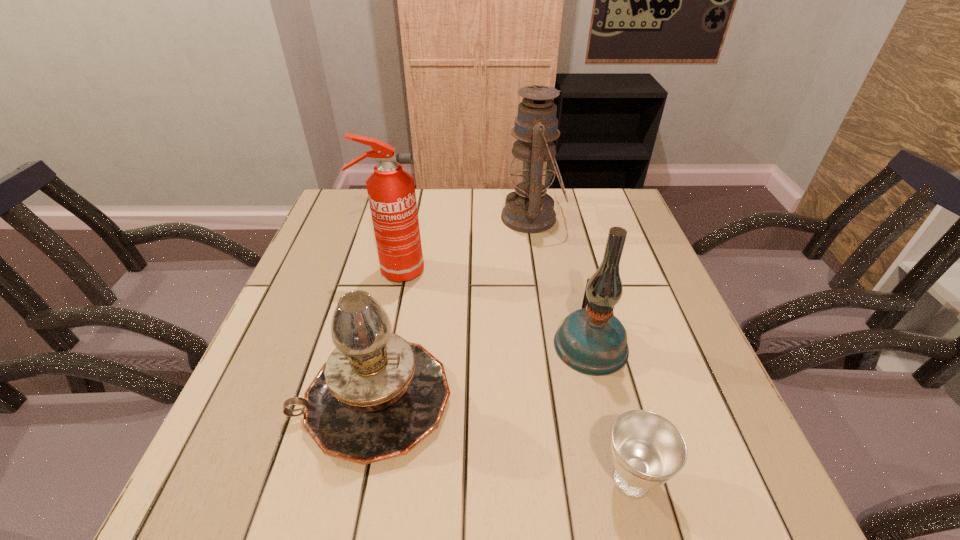
Find the location of a particular element. free space between the leftmost oil lamp and the farthest object is located at coordinates (452, 309).

The width and height of the screenshot is (960, 540). I want to click on free space between the leftmost oil lamp and the farthest object, so click(x=452, y=309).

Identify which object is the third nearest to the farthest object. Please provide its 2D coordinates. Your answer should be formatted as a tuple, i.e. [(x, y)], where the tuple contains the x and y coordinates of a point satisfying the conditions above.

[(377, 397)]

Choose which object is the fourth nearest neighbor to the farthest oil lamp. Please provide its 2D coordinates. Your answer should be formatted as a tuple, i.e. [(x, y)], where the tuple contains the x and y coordinates of a point satisfying the conditions above.

[(647, 450)]

Locate an element on the screen. the closest oil lamp to the leftmost oil lamp is located at coordinates (591, 340).

Where is `the closest oil lamp to the fire extinguisher`? The image size is (960, 540). the closest oil lamp to the fire extinguisher is located at coordinates (377, 397).

At what (x,y) coordinates should I click in order to perform the action: click on vacant space that satisfies the following two spatial constraints: 1. at the nozzle of the chalice; 2. on the right side of the second farthest object. Please return your answer as a coordinate pair (x, y). This screenshot has width=960, height=540. Looking at the image, I should click on (346, 480).

Identify the location of vacant space that satisfies the following two spatial constraints: 1. on the front side of the leftmost oil lamp; 2. on the left side of the chalice. (356, 480).